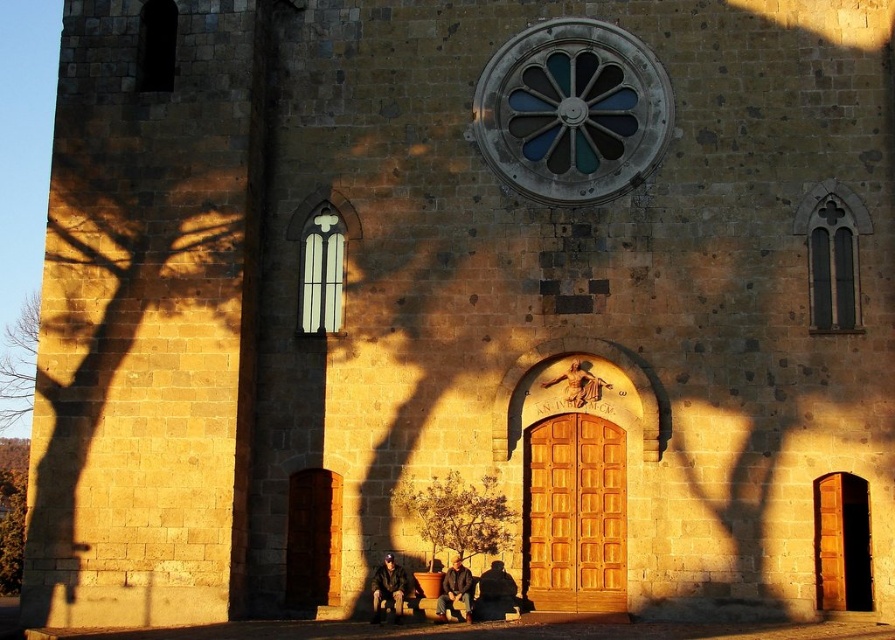
In the scene shown: Is leather jacket at lower center thinner than polished bronze statue at center?

Indeed, leather jacket at lower center has a lesser width compared to polished bronze statue at center.

Does leather jacket at lower center appear under polished bronze statue at center?

Indeed, leather jacket at lower center is positioned under polished bronze statue at center.

What do you see at coordinates (388, 588) in the screenshot?
I see `leather jacket at lower center` at bounding box center [388, 588].

Find the location of a particular element. The image size is (895, 640). leather jacket at lower center is located at coordinates (388, 588).

Does stained glass window at upper center appear on the left side of leather jacket at lower center?

No, stained glass window at upper center is not to the left of leather jacket at lower center.

Which is in front, point (595, 182) or point (382, 598)?

Point (382, 598)

Describe the element at coordinates (572, 112) in the screenshot. The width and height of the screenshot is (895, 640). I see `stained glass window at upper center` at that location.

The width and height of the screenshot is (895, 640). I want to click on stained glass window at upper center, so 572,112.

Which is more to the right, stained glass window at upper center or brown leather jacket at lower center?

stained glass window at upper center

Does stained glass window at upper center appear over brown leather jacket at lower center?

Yes.

Measure the distance between point (x=540, y=140) and camera.

They are 55.04 meters apart.

Find the location of `stained glass window at upper center`. stained glass window at upper center is located at coordinates (572, 112).